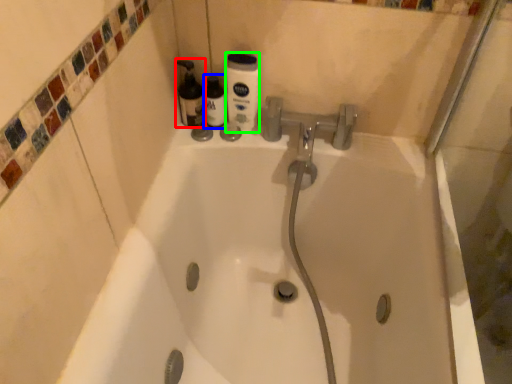
Question: Estimate the real-world distances between objects in this image. Which object is farther from cleaning product (highlighted by a red box), bottle (highlighted by a blue box) or cleaning product (highlighted by a green box)?

Choices:
 (A) bottle
 (B) cleaning product

Answer: (B)